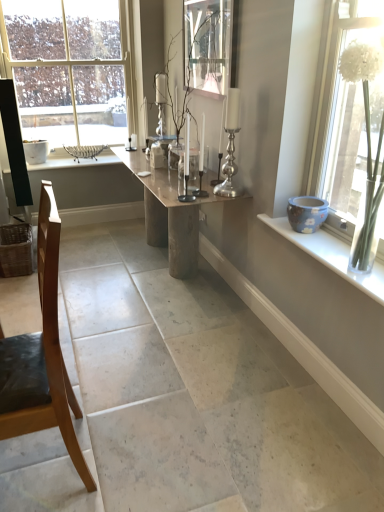
Where is `vacant region to the left of natural wood table at center`? vacant region to the left of natural wood table at center is located at coordinates (89, 261).